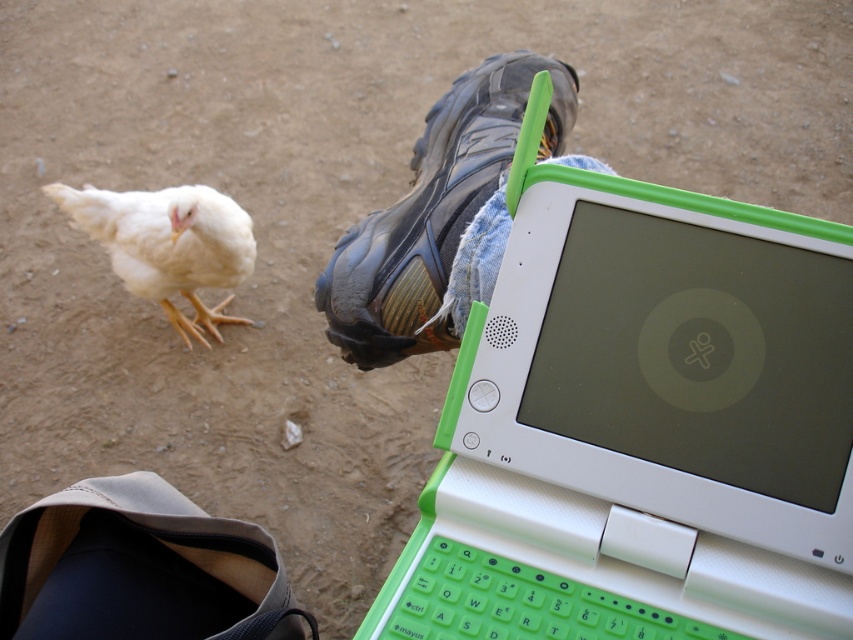
Can you confirm if green plastic laptop at center is shorter than white feathered chicken at lower left?

Indeed, green plastic laptop at center has a lesser height compared to white feathered chicken at lower left.

Is green plastic laptop at center further to the viewer compared to white feathered chicken at lower left?

That is False.

This screenshot has height=640, width=853. What are the coordinates of `green plastic laptop at center` in the screenshot? It's located at (605, 458).